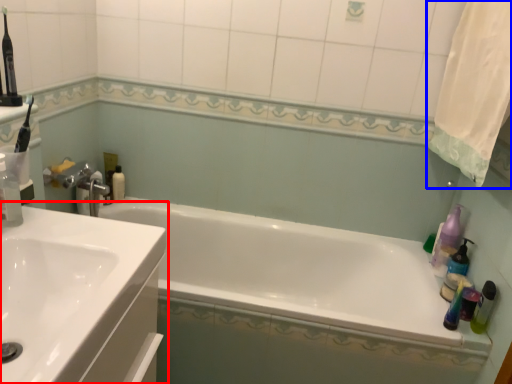
Question: Which of the following is the closest to the observer, sink (highlighted by a red box) or shower curtain (highlighted by a blue box)?

Choices:
 (A) sink
 (B) shower curtain

Answer: (A)